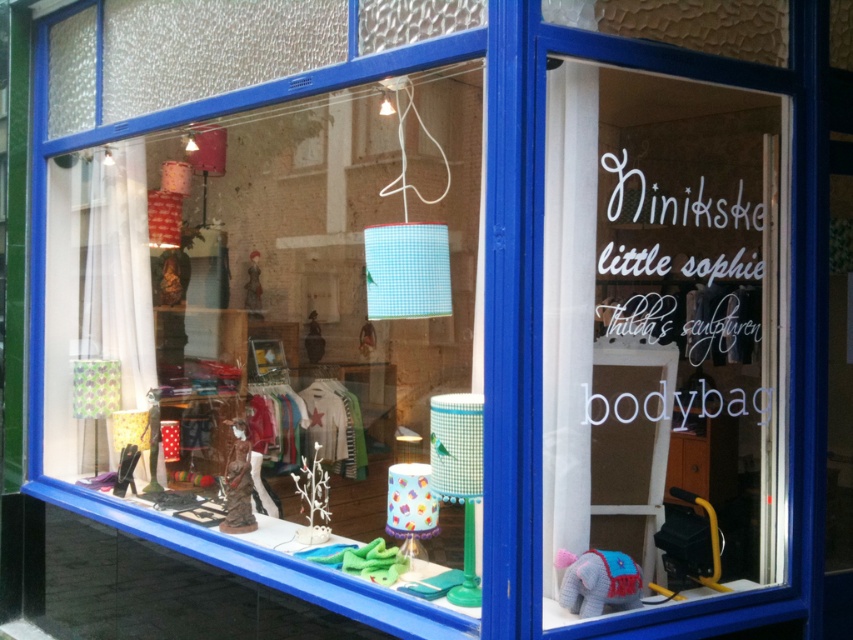
Is point (426, 312) less distant than point (416, 115)?

That is True.

Is point (294, 365) farther from camera compared to point (399, 77)?

Yes, it is behind point (399, 77).

Identify the location of matte fabric lampshade at center. This screenshot has height=640, width=853. click(x=276, y=316).

Describe the element at coordinates (596, 580) in the screenshot. I see `knitted plush elephant at lower right` at that location.

At what (x,y) coordinates should I click in order to perform the action: click on knitted plush elephant at lower right. Please return your answer as a coordinate pair (x, y). The height and width of the screenshot is (640, 853). Looking at the image, I should click on (596, 580).

What are the coordinates of `knitted plush elephant at lower right` in the screenshot? It's located at (596, 580).

Looking at this image, who is positioned more to the right, matte fabric lampshade at center or knitted plush elephant at lower right?

From the viewer's perspective, knitted plush elephant at lower right appears more on the right side.

Is matte fabric lampshade at center to the left of knitted plush elephant at lower right from the viewer's perspective?

Indeed, matte fabric lampshade at center is positioned on the left side of knitted plush elephant at lower right.

What do you see at coordinates (276, 316) in the screenshot? I see `matte fabric lampshade at center` at bounding box center [276, 316].

The width and height of the screenshot is (853, 640). What are the coordinates of `matte fabric lampshade at center` in the screenshot? It's located at (276, 316).